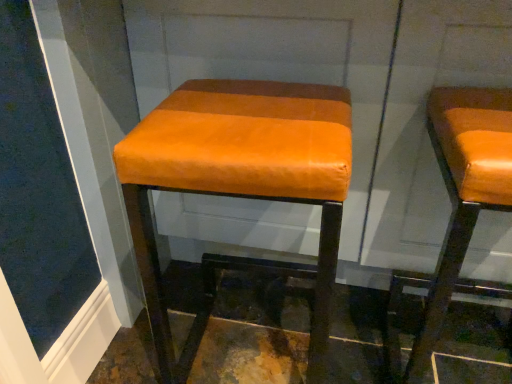
Question: Which direction should I rotate to look at orange leather stool at center, marked as the second stool in a right-to-left arrangement?

Choices:
 (A) left
 (B) right

Answer: (A)

Question: Is the position of orange leather stool at center, marked as the second stool in a right-to-left arrangement, more distant than that of orange leather stool at right, the 1th stool positioned from the right?

Choices:
 (A) yes
 (B) no

Answer: (A)

Question: From the image's perspective, is orange leather stool at center, marked as the second stool in a right-to-left arrangement, below orange leather stool at right, placed as the 2th stool when sorted from left to right?

Choices:
 (A) yes
 (B) no

Answer: (B)

Question: Is orange leather stool at center, placed as the 1th stool when sorted from left to right, next to orange leather stool at right, placed as the 2th stool when sorted from left to right?

Choices:
 (A) yes
 (B) no

Answer: (B)

Question: Is orange leather stool at center, marked as the second stool in a right-to-left arrangement, closer to camera compared to orange leather stool at right, the 1th stool positioned from the right?

Choices:
 (A) no
 (B) yes

Answer: (A)

Question: Considering the relative sizes of orange leather stool at center, placed as the 1th stool when sorted from left to right, and orange leather stool at right, the 1th stool positioned from the right, in the image provided, is orange leather stool at center, placed as the 1th stool when sorted from left to right, thinner than orange leather stool at right, the 1th stool positioned from the right,?

Choices:
 (A) yes
 (B) no

Answer: (A)

Question: Considering the relative sizes of orange leather stool at center, marked as the second stool in a right-to-left arrangement, and orange leather stool at right, the 1th stool positioned from the right, in the image provided, is orange leather stool at center, marked as the second stool in a right-to-left arrangement, smaller than orange leather stool at right, the 1th stool positioned from the right,?

Choices:
 (A) no
 (B) yes

Answer: (A)

Question: Can you confirm if orange leather stool at right, the 1th stool positioned from the right, is shorter than orange leather stool at center, marked as the second stool in a right-to-left arrangement?

Choices:
 (A) yes
 (B) no

Answer: (A)

Question: Considering the relative sizes of orange leather stool at right, placed as the 2th stool when sorted from left to right, and orange leather stool at center, placed as the 1th stool when sorted from left to right, in the image provided, is orange leather stool at right, placed as the 2th stool when sorted from left to right, taller than orange leather stool at center, placed as the 1th stool when sorted from left to right,?

Choices:
 (A) no
 (B) yes

Answer: (A)

Question: Is the depth of orange leather stool at right, placed as the 2th stool when sorted from left to right, greater than that of orange leather stool at center, marked as the second stool in a right-to-left arrangement?

Choices:
 (A) no
 (B) yes

Answer: (A)

Question: Can you confirm if orange leather stool at right, the 1th stool positioned from the right, is smaller than orange leather stool at center, marked as the second stool in a right-to-left arrangement?

Choices:
 (A) yes
 (B) no

Answer: (A)

Question: Is the depth of orange leather stool at right, placed as the 2th stool when sorted from left to right, less than that of orange leather stool at center, placed as the 1th stool when sorted from left to right?

Choices:
 (A) yes
 (B) no

Answer: (A)

Question: From the image's perspective, is orange leather stool at right, the 1th stool positioned from the right, under orange leather stool at center, placed as the 1th stool when sorted from left to right?

Choices:
 (A) yes
 (B) no

Answer: (A)

Question: In terms of height, does orange leather stool at center, marked as the second stool in a right-to-left arrangement, look taller or shorter compared to orange leather stool at right, placed as the 2th stool when sorted from left to right?

Choices:
 (A) short
 (B) tall

Answer: (B)